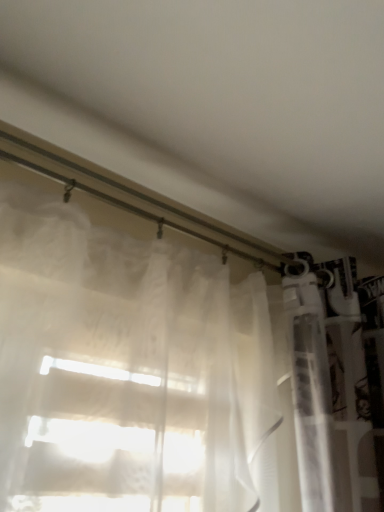
What is the approximate width of transparent fabric at lower left?

transparent fabric at lower left is 24.87 inches in width.

The width and height of the screenshot is (384, 512). What do you see at coordinates (216, 106) in the screenshot?
I see `transparent fabric at lower left` at bounding box center [216, 106].

Image resolution: width=384 pixels, height=512 pixels. What are the coordinates of `transparent fabric at lower left` in the screenshot? It's located at (216, 106).

What are the coordinates of `transparent fabric at lower left` in the screenshot? It's located at (216, 106).